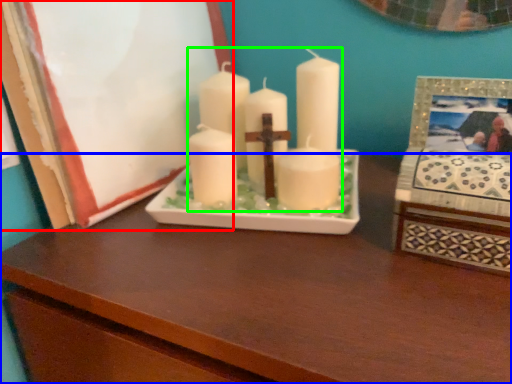
Question: Which is farther away from picture frame (highlighted by a red box)? table (highlighted by a blue box) or candle (highlighted by a green box)?

Choices:
 (A) table
 (B) candle

Answer: (A)